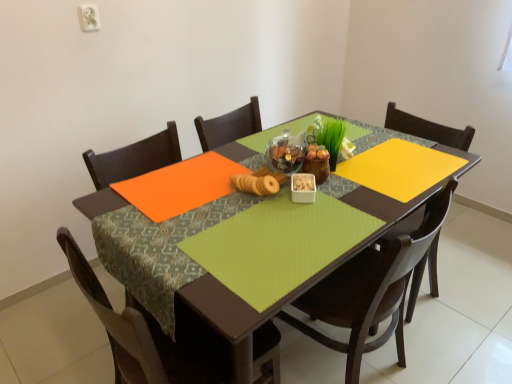
This screenshot has width=512, height=384. Find the location of `unoccupied region to the right of white plastic container at center`. unoccupied region to the right of white plastic container at center is located at coordinates pyautogui.click(x=355, y=197).